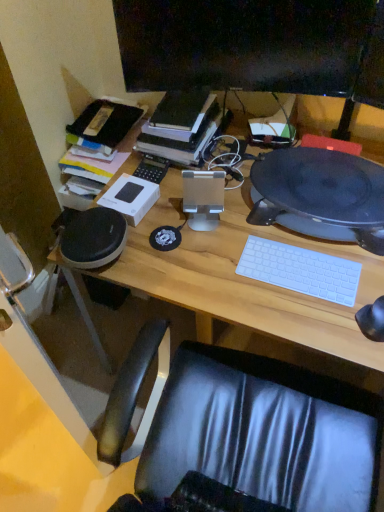
Question: Is black glossy monitor at upper center further to the viewer compared to wooden desk at center?

Choices:
 (A) no
 (B) yes

Answer: (B)

Question: Does black glossy monitor at upper center contain wooden desk at center?

Choices:
 (A) yes
 (B) no

Answer: (B)

Question: Is black glossy monitor at upper center shorter than wooden desk at center?

Choices:
 (A) yes
 (B) no

Answer: (A)

Question: Is black glossy monitor at upper center oriented towards wooden desk at center?

Choices:
 (A) no
 (B) yes

Answer: (A)

Question: Is black glossy monitor at upper center at the left side of wooden desk at center?

Choices:
 (A) no
 (B) yes

Answer: (B)

Question: Considering their positions, is white matte keyboard at center located in front of or behind black glossy monitor at upper center?

Choices:
 (A) front
 (B) behind

Answer: (A)

Question: In terms of width, does white matte keyboard at center look wider or thinner when compared to black glossy monitor at upper center?

Choices:
 (A) thin
 (B) wide

Answer: (B)

Question: From a real-world perspective, relative to black glossy monitor at upper center, is white matte keyboard at center vertically above or below?

Choices:
 (A) above
 (B) below

Answer: (B)

Question: Considering the positions of white matte keyboard at center and black glossy monitor at upper center in the image, is white matte keyboard at center taller or shorter than black glossy monitor at upper center?

Choices:
 (A) short
 (B) tall

Answer: (A)

Question: Considering the positions of point (332, 292) and point (286, 201), is point (332, 292) closer or farther from the camera than point (286, 201)?

Choices:
 (A) farther
 (B) closer

Answer: (B)

Question: Visually, is white matte keyboard at center positioned to the left or to the right of black matte speaker at right?

Choices:
 (A) right
 (B) left

Answer: (B)

Question: From the image's perspective, is white matte keyboard at center positioned above or below black matte speaker at right?

Choices:
 (A) below
 (B) above

Answer: (A)

Question: In terms of height, does white matte keyboard at center look taller or shorter compared to black matte speaker at right?

Choices:
 (A) tall
 (B) short

Answer: (B)

Question: Is wooden desk at center wider or thinner than hardcover book at center?

Choices:
 (A) wide
 (B) thin

Answer: (A)

Question: From their relative heights in the image, would you say wooden desk at center is taller or shorter than hardcover book at center?

Choices:
 (A) short
 (B) tall

Answer: (B)